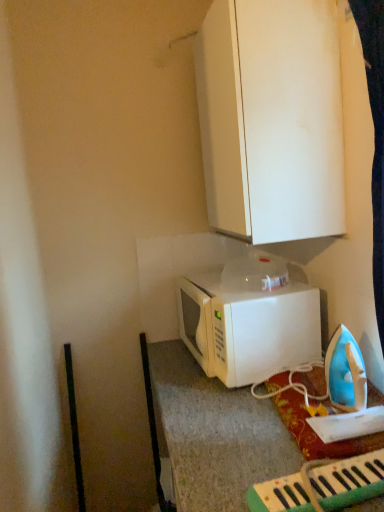
Question: From the image's perspective, is green plastic keyboard at lower right under white matte cabinet at upper center?

Choices:
 (A) no
 (B) yes

Answer: (B)

Question: Is green plastic keyboard at lower right bigger than white matte cabinet at upper center?

Choices:
 (A) yes
 (B) no

Answer: (B)

Question: Is green plastic keyboard at lower right thinner than white matte cabinet at upper center?

Choices:
 (A) yes
 (B) no

Answer: (B)

Question: Is green plastic keyboard at lower right directly adjacent to white matte cabinet at upper center?

Choices:
 (A) yes
 (B) no

Answer: (B)

Question: Is green plastic keyboard at lower right closer to the viewer compared to white matte cabinet at upper center?

Choices:
 (A) yes
 (B) no

Answer: (A)

Question: Considering the relative positions of white matte cabinet at upper center and white matte microwave at center in the image provided, is white matte cabinet at upper center to the left or to the right of white matte microwave at center?

Choices:
 (A) left
 (B) right

Answer: (B)

Question: From a real-world perspective, is white matte cabinet at upper center physically located above or below white matte microwave at center?

Choices:
 (A) below
 (B) above

Answer: (B)

Question: Considering the positions of point (198, 45) and point (263, 314), is point (198, 45) closer or farther from the camera than point (263, 314)?

Choices:
 (A) farther
 (B) closer

Answer: (A)

Question: From their relative heights in the image, would you say white matte cabinet at upper center is taller or shorter than white matte microwave at center?

Choices:
 (A) short
 (B) tall

Answer: (B)

Question: Considering the positions of white matte cabinet at upper center and green plastic keyboard at lower right in the image, is white matte cabinet at upper center wider or thinner than green plastic keyboard at lower right?

Choices:
 (A) thin
 (B) wide

Answer: (A)

Question: Would you say white matte cabinet at upper center is to the left or to the right of green plastic keyboard at lower right in the picture?

Choices:
 (A) left
 (B) right

Answer: (A)

Question: Is point (246, 202) positioned closer to the camera than point (276, 481)?

Choices:
 (A) farther
 (B) closer

Answer: (A)

Question: From their relative heights in the image, would you say white matte cabinet at upper center is taller or shorter than green plastic keyboard at lower right?

Choices:
 (A) short
 (B) tall

Answer: (B)

Question: From the image's perspective, is green plastic keyboard at lower right located above or below white matte cabinet at upper center?

Choices:
 (A) above
 (B) below

Answer: (B)

Question: Would you say green plastic keyboard at lower right is to the left or to the right of white matte cabinet at upper center in the picture?

Choices:
 (A) right
 (B) left

Answer: (A)